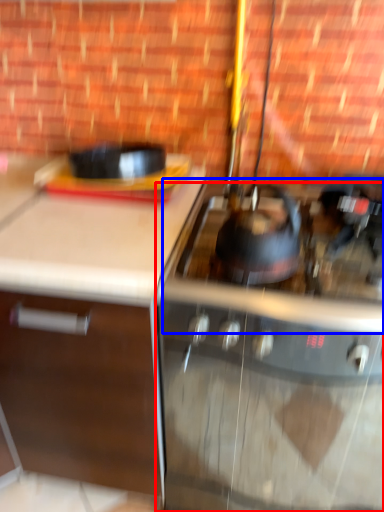
Question: Which object is further to the camera taking this photo, gas stove (highlighted by a red box) or gas stove (highlighted by a blue box)?

Choices:
 (A) gas stove
 (B) gas stove

Answer: (A)